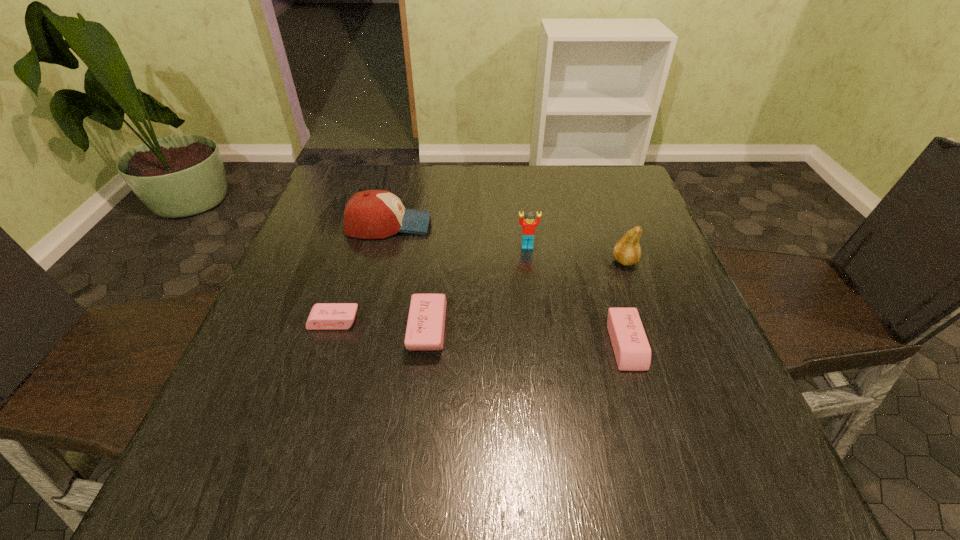
Where is `free space located 0.380m on the right of the leftmost eraser`? free space located 0.380m on the right of the leftmost eraser is located at coordinates (547, 322).

Find the location of `vacant space positioned 0.200m on the back of the fourth tallest object`. vacant space positioned 0.200m on the back of the fourth tallest object is located at coordinates (438, 242).

The image size is (960, 540). Find the location of `vacant space located on the front of the second shortest object`. vacant space located on the front of the second shortest object is located at coordinates (653, 434).

The image size is (960, 540). I want to click on vacant space situated 0.210m on the front-facing side of the baseball cap, so click(513, 225).

At what (x,y) coordinates should I click in order to perform the action: click on free spot located 0.170m on the face of the third object from right to left. Please return your answer as a coordinate pair (x, y). The height and width of the screenshot is (540, 960). Looking at the image, I should click on (534, 301).

Find the location of `vacant space located on the left of the pear`. vacant space located on the left of the pear is located at coordinates (516, 261).

This screenshot has height=540, width=960. What are the coordinates of `object that is at the far edge` in the screenshot? It's located at (372, 214).

Where is `eraser at the left edge`? Image resolution: width=960 pixels, height=540 pixels. eraser at the left edge is located at coordinates (324, 316).

This screenshot has height=540, width=960. In order to click on baseball cap that is at the left edge in this screenshot , I will do `click(372, 214)`.

What are the coordinates of `eraser located at the right edge` in the screenshot? It's located at (632, 351).